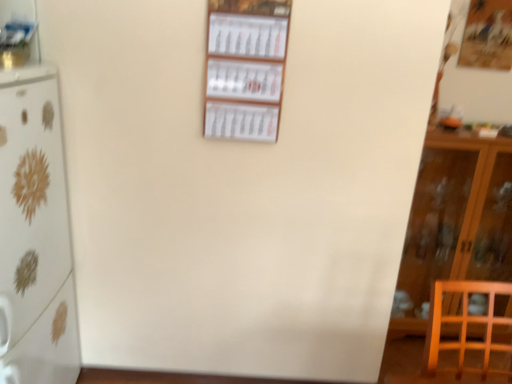
Question: From the image's perspective, is wooden cabinet at right beneath white glossy refrigerator at left?

Choices:
 (A) no
 (B) yes

Answer: (A)

Question: Does wooden cabinet at right have a greater width compared to white glossy refrigerator at left?

Choices:
 (A) no
 (B) yes

Answer: (A)

Question: Does wooden cabinet at right have a larger size compared to white glossy refrigerator at left?

Choices:
 (A) no
 (B) yes

Answer: (A)

Question: Is wooden cabinet at right to the right of white glossy refrigerator at left from the viewer's perspective?

Choices:
 (A) no
 (B) yes

Answer: (B)

Question: Is the position of wooden cabinet at right less distant than that of white glossy refrigerator at left?

Choices:
 (A) no
 (B) yes

Answer: (A)

Question: Is wooden cabinet at right further to the viewer compared to white glossy refrigerator at left?

Choices:
 (A) no
 (B) yes

Answer: (B)

Question: Is metallic silver shelf at upper left, the first shelf viewed from the left, positioned before white paper calendar at center, the first shelf viewed from the right?

Choices:
 (A) no
 (B) yes

Answer: (B)

Question: Is metallic silver shelf at upper left, which is the 2th shelf from right to left, bigger than white paper calendar at center, which is the 2th shelf in left-to-right order?

Choices:
 (A) no
 (B) yes

Answer: (A)

Question: From a real-world perspective, does metallic silver shelf at upper left, the first shelf viewed from the left, stand above white paper calendar at center, which is the 2th shelf in left-to-right order?

Choices:
 (A) no
 (B) yes

Answer: (B)

Question: From a real-world perspective, is metallic silver shelf at upper left, which is the 2th shelf from right to left, located beneath white paper calendar at center, the first shelf viewed from the right?

Choices:
 (A) yes
 (B) no

Answer: (B)

Question: Does metallic silver shelf at upper left, the first shelf viewed from the left, appear on the left side of white paper calendar at center, which is the 2th shelf in left-to-right order?

Choices:
 (A) yes
 (B) no

Answer: (A)

Question: From the image's perspective, does metallic silver shelf at upper left, which is the 2th shelf from right to left, appear lower than white paper calendar at center, which is the 2th shelf in left-to-right order?

Choices:
 (A) no
 (B) yes

Answer: (A)

Question: From the image's perspective, is white glossy refrigerator at left located beneath white paper calendar at center, the first shelf viewed from the right?

Choices:
 (A) no
 (B) yes

Answer: (B)